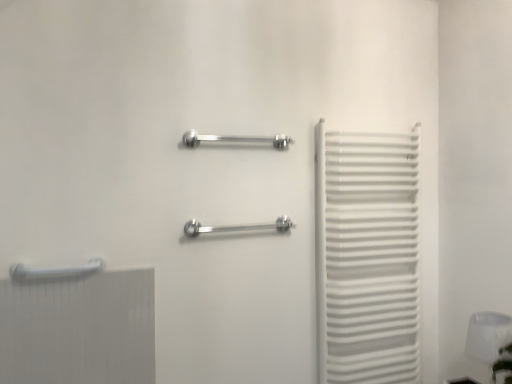
Measure the distance between point (365, 200) and camera.

Point (365, 200) and camera are 6.25 feet apart from each other.

Identify the location of polished metal towel rack at center, the 1th towel rack positioned from the right. (237, 227).

What is the approximate height of white glossy towel rack at lower left, positioned as the first towel rack in left-to-right order?

The height of white glossy towel rack at lower left, positioned as the first towel rack in left-to-right order, is 6.91 centimeters.

Image resolution: width=512 pixels, height=384 pixels. I want to click on polished chrome towel rack at center, which is the first towel rack from top to bottom, so [234, 140].

Does white glossy towel rack at right have a lesser height compared to white glossy towel rack at lower left, marked as the 3th towel rack in a right-to-left arrangement?

In fact, white glossy towel rack at right may be taller than white glossy towel rack at lower left, marked as the 3th towel rack in a right-to-left arrangement.

In the scene shown: Is white glossy towel rack at right not near white glossy towel rack at lower left, positioned as the third towel rack in top-to-bottom order?

Yes.

Would you say white glossy towel rack at right is inside or outside white glossy towel rack at lower left, marked as the 3th towel rack in a right-to-left arrangement?

white glossy towel rack at right is outside white glossy towel rack at lower left, marked as the 3th towel rack in a right-to-left arrangement.

In the image, is white glossy towel rack at right positioned in front of or behind white glossy towel rack at lower left, positioned as the first towel rack in left-to-right order?

In the image, white glossy towel rack at right appears behind white glossy towel rack at lower left, positioned as the first towel rack in left-to-right order.

Would you say white glossy lampshade at lower right is to the left or to the right of white glossy towel rack at right in the picture?

From the image, it's evident that white glossy lampshade at lower right is to the right of white glossy towel rack at right.

How distant is white glossy lampshade at lower right from white glossy towel rack at right?

white glossy lampshade at lower right and white glossy towel rack at right are 20.65 inches apart.

Is white glossy lampshade at lower right outside of white glossy towel rack at right?

Yes, white glossy lampshade at lower right is not within white glossy towel rack at right.

Considering the positions of points (510, 336) and (367, 220), is point (510, 336) closer to camera compared to point (367, 220)?

Yes, point (510, 336) is closer to viewer.

Considering the sizes of polished metal towel rack at center, which is the second towel rack from top to bottom, and white glossy towel rack at right in the image, is polished metal towel rack at center, which is the second towel rack from top to bottom, taller or shorter than white glossy towel rack at right?

In the image, polished metal towel rack at center, which is the second towel rack from top to bottom, appears to be shorter than white glossy towel rack at right.

Is white glossy towel rack at right a part of polished metal towel rack at center, the second towel rack positioned from the bottom?

No.

From the image's perspective, which is above, white glossy lampshade at lower right or polished chrome towel rack at center, which is the first towel rack from top to bottom?

polished chrome towel rack at center, which is the first towel rack from top to bottom, is shown above in the image.

Who is shorter, white glossy lampshade at lower right or polished chrome towel rack at center, which is the first towel rack from top to bottom?

Standing shorter between the two is polished chrome towel rack at center, which is the first towel rack from top to bottom.

From a real-world perspective, which is physically above, white glossy lampshade at lower right or polished chrome towel rack at center, which is the first towel rack from top to bottom?

In real-world perspective, polished chrome towel rack at center, which is the first towel rack from top to bottom, is above.

Can polished chrome towel rack at center, which ranks as the 2th towel rack in right-to-left order, be found inside white glossy lampshade at lower right?

No, white glossy lampshade at lower right does not contain polished chrome towel rack at center, which ranks as the 2th towel rack in right-to-left order.

Does polished chrome towel rack at center, the 3th towel rack ordered from the bottom, contain white glossy towel rack at right?

Actually, white glossy towel rack at right is outside polished chrome towel rack at center, the 3th towel rack ordered from the bottom.

Is white glossy towel rack at right at the back of polished chrome towel rack at center, the second towel rack when ordered from left to right?

That's not correct — polished chrome towel rack at center, the second towel rack when ordered from left to right, is not looking away from white glossy towel rack at right.

Relative to white glossy towel rack at right, is polished chrome towel rack at center, which ranks as the 2th towel rack in right-to-left order, in front or behind?

polished chrome towel rack at center, which ranks as the 2th towel rack in right-to-left order, is positioned closer to the viewer than white glossy towel rack at right.

Does white glossy towel rack at lower left, marked as the 3th towel rack in a right-to-left arrangement, have a greater width compared to white glossy towel rack at right?

Incorrect, the width of white glossy towel rack at lower left, marked as the 3th towel rack in a right-to-left arrangement, does not surpass that of white glossy towel rack at right.

From their relative heights in the image, would you say white glossy towel rack at lower left, marked as the 3th towel rack in a right-to-left arrangement, is taller or shorter than white glossy towel rack at right?

white glossy towel rack at lower left, marked as the 3th towel rack in a right-to-left arrangement, is shorter than white glossy towel rack at right.

Would you consider white glossy towel rack at lower left, which appears as the 1th towel rack when ordered from the bottom, to be distant from white glossy towel rack at right?

white glossy towel rack at lower left, which appears as the 1th towel rack when ordered from the bottom, is positioned a significant distance from white glossy towel rack at right.

Considering the positions of point (66, 274) and point (369, 141), is point (66, 274) closer or farther from the camera than point (369, 141)?

Point (66, 274) is closer to the camera than point (369, 141).

Looking at this image, is white glossy towel rack at lower left, which appears as the 1th towel rack when ordered from the bottom, inside or outside of polished metal towel rack at center, which ranks as the third towel rack in left-to-right order?

white glossy towel rack at lower left, which appears as the 1th towel rack when ordered from the bottom, is spatially situated outside polished metal towel rack at center, which ranks as the third towel rack in left-to-right order.

Between white glossy towel rack at lower left, positioned as the third towel rack in top-to-bottom order, and polished metal towel rack at center, which ranks as the third towel rack in left-to-right order, which one has larger size?

polished metal towel rack at center, which ranks as the third towel rack in left-to-right order, is bigger.

You are a GUI agent. You are given a task and a screenshot of the screen. Output one action in this format:
    pyautogui.click(x=<x>, y=<y>)
    Task: Click on the towel rack that is the 1st object above the white glossy towel rack at right (from a real-world perspective)
    The image size is (512, 384).
    Given the screenshot: What is the action you would take?
    pyautogui.click(x=55, y=271)

Where is `lamp to the right of white glossy towel rack at right`? lamp to the right of white glossy towel rack at right is located at coordinates (487, 336).

Estimate the real-world distances between objects in this image. Which object is closer to polished chrome towel rack at center, which is the first towel rack from top to bottom, white glossy lampshade at lower right or polished metal towel rack at center, the 1th towel rack positioned from the right?

polished metal towel rack at center, the 1th towel rack positioned from the right, is closer to polished chrome towel rack at center, which is the first towel rack from top to bottom.

When comparing their distances from polished chrome towel rack at center, which ranks as the 2th towel rack in right-to-left order, does white glossy towel rack at lower left, positioned as the third towel rack in top-to-bottom order, or white glossy lampshade at lower right seem closer?

white glossy towel rack at lower left, positioned as the third towel rack in top-to-bottom order, is closer to polished chrome towel rack at center, which ranks as the 2th towel rack in right-to-left order.

Based on their spatial positions, is white glossy towel rack at right or polished chrome towel rack at center, which is the first towel rack from top to bottom, closer to polished metal towel rack at center, which is the second towel rack from top to bottom?

Among the two, polished chrome towel rack at center, which is the first towel rack from top to bottom, is located nearer to polished metal towel rack at center, which is the second towel rack from top to bottom.

From the picture: Based on their spatial positions, is polished chrome towel rack at center, the second towel rack when ordered from left to right, or white glossy towel rack at lower left, positioned as the third towel rack in top-to-bottom order, further from white glossy lampshade at lower right?

white glossy towel rack at lower left, positioned as the third towel rack in top-to-bottom order, is positioned further to the anchor white glossy lampshade at lower right.

When comparing their distances from white glossy towel rack at right, does polished chrome towel rack at center, which is the first towel rack from top to bottom, or white glossy towel rack at lower left, positioned as the third towel rack in top-to-bottom order, seem further?

white glossy towel rack at lower left, positioned as the third towel rack in top-to-bottom order.

Based on their spatial positions, is white glossy lampshade at lower right or white glossy towel rack at right further from white glossy towel rack at lower left, positioned as the first towel rack in left-to-right order?

white glossy lampshade at lower right lies further to white glossy towel rack at lower left, positioned as the first towel rack in left-to-right order, than the other object.

Looking at this image, based on their spatial positions, is white glossy towel rack at lower left, positioned as the first towel rack in left-to-right order, or polished metal towel rack at center, which is the second towel rack from top to bottom, closer to polished chrome towel rack at center, the second towel rack when ordered from left to right?

polished metal towel rack at center, which is the second towel rack from top to bottom, lies closer to polished chrome towel rack at center, the second towel rack when ordered from left to right, than the other object.

When comparing their distances from polished metal towel rack at center, the 1th towel rack positioned from the right, does white glossy towel rack at lower left, marked as the 3th towel rack in a right-to-left arrangement, or white glossy towel rack at right seem further?

white glossy towel rack at lower left, marked as the 3th towel rack in a right-to-left arrangement, is further to polished metal towel rack at center, the 1th towel rack positioned from the right.

Where is `towel rack located between polished chrome towel rack at center, which ranks as the 2th towel rack in right-to-left order, and white glossy lampshade at lower right in the left-right direction`? Image resolution: width=512 pixels, height=384 pixels. towel rack located between polished chrome towel rack at center, which ranks as the 2th towel rack in right-to-left order, and white glossy lampshade at lower right in the left-right direction is located at coordinates (237, 227).

You are a GUI agent. You are given a task and a screenshot of the screen. Output one action in this format:
    pyautogui.click(x=<x>, y=<y>)
    Task: Click on the curtain between polished metal towel rack at center, which is the second towel rack from top to bottom, and white glossy lampshade at lower right from left to right
    The height and width of the screenshot is (384, 512).
    Given the screenshot: What is the action you would take?
    pyautogui.click(x=367, y=256)

This screenshot has width=512, height=384. In order to click on towel rack between polished chrome towel rack at center, the second towel rack when ordered from left to right, and white glossy towel rack at right, in the horizontal direction in this screenshot , I will do `click(237, 227)`.

The width and height of the screenshot is (512, 384). In order to click on towel rack between white glossy towel rack at lower left, which appears as the 1th towel rack when ordered from the bottom, and polished metal towel rack at center, which ranks as the third towel rack in left-to-right order, in the horizontal direction in this screenshot , I will do `click(234, 140)`.